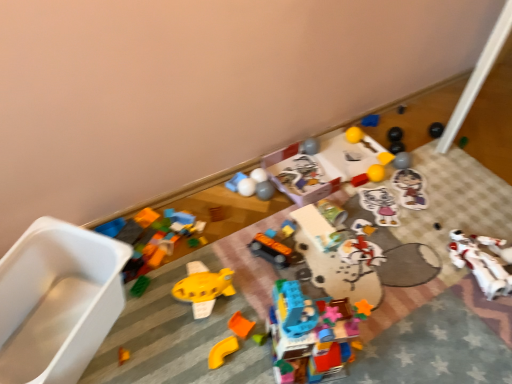
The height and width of the screenshot is (384, 512). Identify the location of vacant space to the right of matte black car at center, the eighth toy positioned from the left. (316, 264).